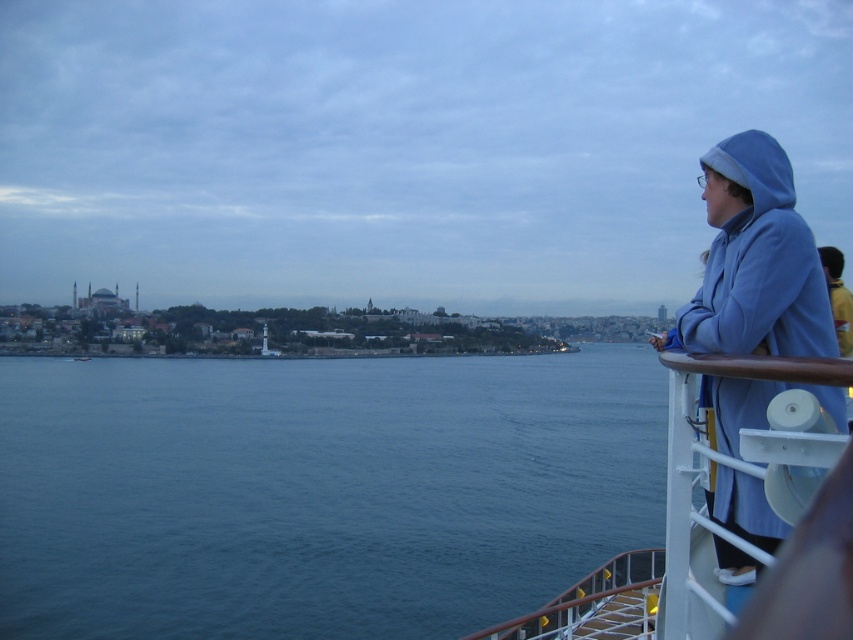
Question: Which object is positioned farthest from the blue fleece hoodie at right?

Choices:
 (A) blue water at lower left
 (B) white plastic railing at right

Answer: (A)

Question: Which point is closer to the camera?

Choices:
 (A) (743, 358)
 (B) (195, 582)
 (C) (708, 301)

Answer: (A)

Question: Can you confirm if blue water at lower left is positioned below white plastic railing at right?

Choices:
 (A) no
 (B) yes

Answer: (B)

Question: Does blue fleece hoodie at right have a lesser width compared to white plastic railing at right?

Choices:
 (A) yes
 (B) no

Answer: (A)

Question: Is blue water at lower left bigger than blue fleece hoodie at right?

Choices:
 (A) yes
 (B) no

Answer: (A)

Question: Which point is farther to the camera?

Choices:
 (A) blue fleece hoodie at right
 (B) white plastic railing at right
 (C) blue water at lower left

Answer: (C)